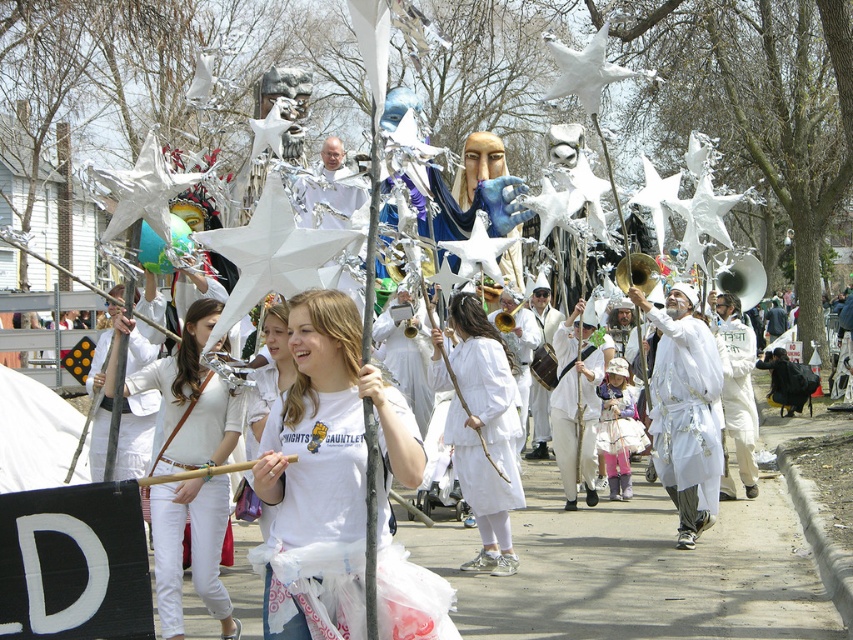
Which is in front, point (215, 518) or point (599, 390)?

Point (215, 518) is more forward.

Which is below, white cotton shirt at center or white cotton dress at center?

Positioned lower is white cotton dress at center.

Locate an element on the screen. This screenshot has width=853, height=640. white cotton shirt at center is located at coordinates tap(193, 394).

Who is more distant from viewer, (508, 504) or (582, 380)?

Point (582, 380)

How far apart are white matte dress at center and white matte mask at center?

9.51 feet

This screenshot has width=853, height=640. I want to click on white matte dress at center, so click(485, 433).

Based on the photo, is white cotton shirt at center closer to camera compared to white matte costume at center?

That is True.

Can you confirm if white cotton shirt at center is taller than white matte costume at center?

Correct, white cotton shirt at center is much taller as white matte costume at center.

Is point (181, 340) less distant than point (712, 458)?

Yes, it is in front of point (712, 458).

You are a GUI agent. You are given a task and a screenshot of the screen. Output one action in this format:
    pyautogui.click(x=<x>, y=<y>)
    Task: Click on the white cotton shirt at center
    
    Given the screenshot: What is the action you would take?
    pyautogui.click(x=193, y=394)